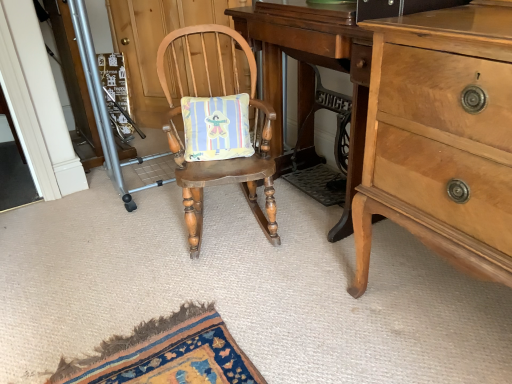
Where is `vacant space positioned to the left of wooden rocking chair at center`? vacant space positioned to the left of wooden rocking chair at center is located at coordinates (126, 243).